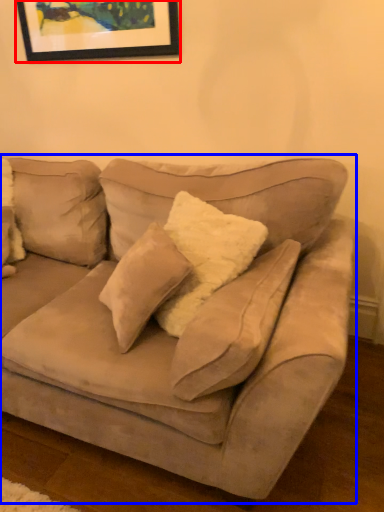
Question: Which object appears closest to the camera in this image, picture frame (highlighted by a red box) or studio couch (highlighted by a blue box)?

Choices:
 (A) picture frame
 (B) studio couch

Answer: (B)